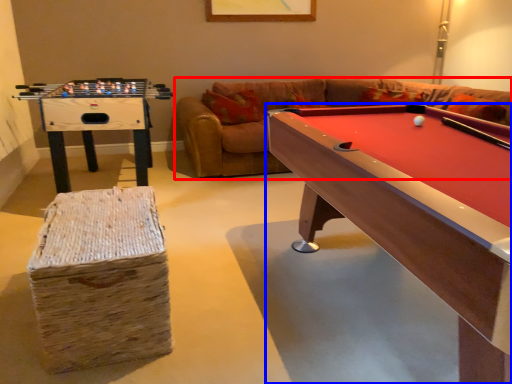
Question: Which of the following is the farthest to the observer, couch (highlighted by a red box) or billiard table (highlighted by a blue box)?

Choices:
 (A) couch
 (B) billiard table

Answer: (A)